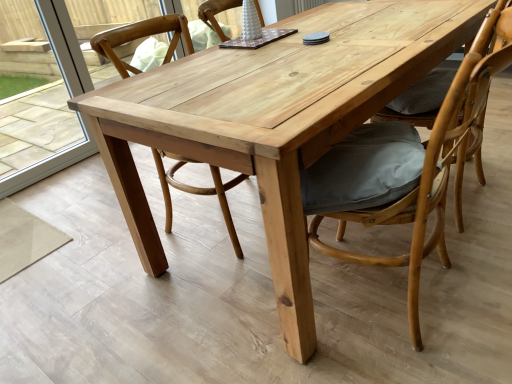
Question: Is transparent glass door at left not inside matte gray cushion at right, the 3th chair viewed from the left?

Choices:
 (A) yes
 (B) no

Answer: (A)

Question: Are transparent glass door at left and matte gray cushion at right, the 3th chair viewed from the left, beside each other?

Choices:
 (A) yes
 (B) no

Answer: (B)

Question: Is transparent glass door at left facing towards matte gray cushion at right, arranged as the 1th chair when viewed from the right?

Choices:
 (A) no
 (B) yes

Answer: (B)

Question: From the image's perspective, is transparent glass door at left located above matte gray cushion at right, the 3th chair viewed from the left?

Choices:
 (A) yes
 (B) no

Answer: (A)

Question: Is transparent glass door at left closer to camera compared to matte gray cushion at right, arranged as the 1th chair when viewed from the right?

Choices:
 (A) no
 (B) yes

Answer: (A)

Question: Is matte gray cushion at right, the 3th chair viewed from the left, surrounded by transparent glass door at left?

Choices:
 (A) yes
 (B) no

Answer: (B)

Question: Can you confirm if matte gray cushion at right, arranged as the 1th chair when viewed from the right, is positioned to the left of natural wood chair at center, which is counted as the 1th chair, starting from the left?

Choices:
 (A) no
 (B) yes

Answer: (A)

Question: Is matte gray cushion at right, the 3th chair viewed from the left, positioned beyond the bounds of natural wood chair at center, which is counted as the 1th chair, starting from the left?

Choices:
 (A) yes
 (B) no

Answer: (A)

Question: Would you say matte gray cushion at right, the 3th chair viewed from the left, contains natural wood chair at center, the 3th chair from the right?

Choices:
 (A) no
 (B) yes

Answer: (A)

Question: Does matte gray cushion at right, arranged as the 1th chair when viewed from the right, have a smaller size compared to natural wood chair at center, the 3th chair from the right?

Choices:
 (A) yes
 (B) no

Answer: (B)

Question: Is matte gray cushion at right, the 3th chair viewed from the left, positioned far away from natural wood chair at center, which is counted as the 1th chair, starting from the left?

Choices:
 (A) yes
 (B) no

Answer: (B)

Question: Is matte gray cushion at right, the 3th chair viewed from the left, positioned behind natural wood chair at center, which is counted as the 1th chair, starting from the left?

Choices:
 (A) no
 (B) yes

Answer: (A)

Question: Is matte gray cushion at right, arranged as the 1th chair when viewed from the right, aimed at transparent glass door at left?

Choices:
 (A) yes
 (B) no

Answer: (A)